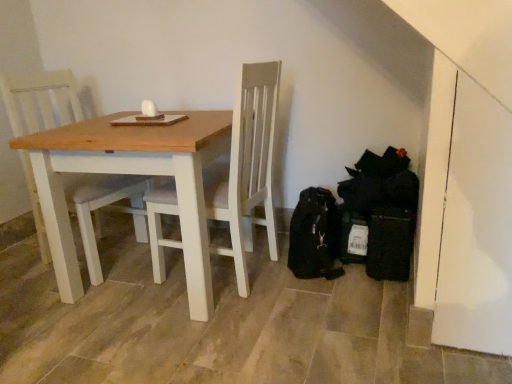
The width and height of the screenshot is (512, 384). Find the location of `white wood chair at center`. white wood chair at center is located at coordinates (105, 206).

What do you see at coordinates (105, 206) in the screenshot? I see `white wood chair at center` at bounding box center [105, 206].

What do you see at coordinates (132, 174) in the screenshot?
I see `wooden table at center` at bounding box center [132, 174].

Locate an element on the screen. The width and height of the screenshot is (512, 384). wooden table at center is located at coordinates (132, 174).

At what (x,y) coordinates should I click in order to perform the action: click on white wood chair at center. Please return your answer as a coordinate pair (x, y). The width and height of the screenshot is (512, 384). Looking at the image, I should click on (105, 206).

Does white wood chair at center appear on the right side of wooden table at center?

No, white wood chair at center is not to the right of wooden table at center.

Who is more distant, white wood chair at center or wooden table at center?

white wood chair at center is further from the camera.

Does point (32, 74) come closer to viewer compared to point (63, 160)?

No, (32, 74) is behind (63, 160).

From the image's perspective, is white wood chair at center under wooden table at center?

Incorrect, from the image's perspective, white wood chair at center is higher than wooden table at center.

From a real-world perspective, which is physically below, white wood chair at center or wooden table at center?

wooden table at center is physically lower.

Does white wood chair at center have a lesser width compared to wooden table at center?

Yes.

Who is taller, white wood chair at center or wooden table at center?

With more height is white wood chair at center.

Who is bigger, white wood chair at center or wooden table at center?

Bigger between the two is wooden table at center.

Is white wood chair at center not within wooden table at center?

Actually, white wood chair at center is within wooden table at center.

Is the surface of white wood chair at center in direct contact with wooden table at center?

white wood chair at center and wooden table at center are not in contact.

In the scene shown: Does white wood chair at center turn towards wooden table at center?

Yes.

Measure the distance between white wood chair at center and wooden table at center.

white wood chair at center is 9.71 inches away from wooden table at center.

I want to click on table that appears below the white wood chair at center (from a real-world perspective), so click(x=132, y=174).

Is wooden table at center to the left of white wood chair at center from the viewer's perspective?

No, wooden table at center is not to the left of white wood chair at center.

Is wooden table at center positioned before white wood chair at center?

Yes.

Which is closer to the camera, (242, 241) or (17, 87)?

Point (242, 241).

From the image's perspective, is wooden table at center under white wood chair at center?

Yes, from the image's perspective, wooden table at center is below white wood chair at center.

From a real-world perspective, which is physically below, wooden table at center or white wood chair at center?

From a 3D spatial view, wooden table at center is below.

Does wooden table at center have a greater width compared to white wood chair at center?

Yes, wooden table at center is wider than white wood chair at center.

Consider the image. Considering the relative sizes of wooden table at center and white wood chair at center in the image provided, is wooden table at center taller than white wood chair at center?

Incorrect, the height of wooden table at center is not larger of that of white wood chair at center.

Is wooden table at center bigger than white wood chair at center?

Yes, wooden table at center is bigger than white wood chair at center.

Is wooden table at center completely or partially outside of white wood chair at center?

Yes, wooden table at center is outside of white wood chair at center.

Is wooden table at center beside white wood chair at center?

No, wooden table at center is not next to white wood chair at center.

Does wooden table at center turn towards white wood chair at center?

No, wooden table at center is not oriented towards white wood chair at center.

Can you tell me how much wooden table at center and white wood chair at center differ in facing direction?

There is a 14.6-degree angle between the facing directions of wooden table at center and white wood chair at center.

Find the location of `chair lying on the left of wooden table at center`. chair lying on the left of wooden table at center is located at coordinates (105, 206).

This screenshot has height=384, width=512. In order to click on table on the right of white wood chair at center in this screenshot , I will do `click(132, 174)`.

The image size is (512, 384). There is a wooden table at center. Identify the location of chair above it (from a real-world perspective). (105, 206).